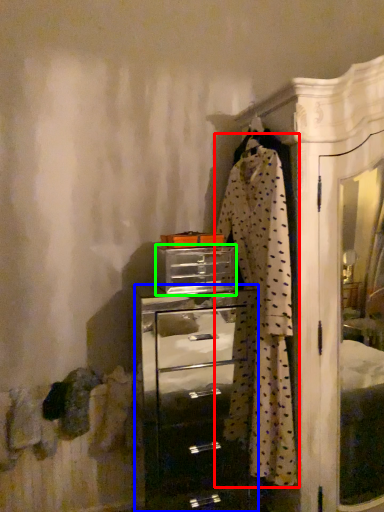
Question: Which is farther away from clothing (highlighted by a red box)? chest of drawers (highlighted by a blue box) or drawer (highlighted by a green box)?

Choices:
 (A) chest of drawers
 (B) drawer

Answer: (A)